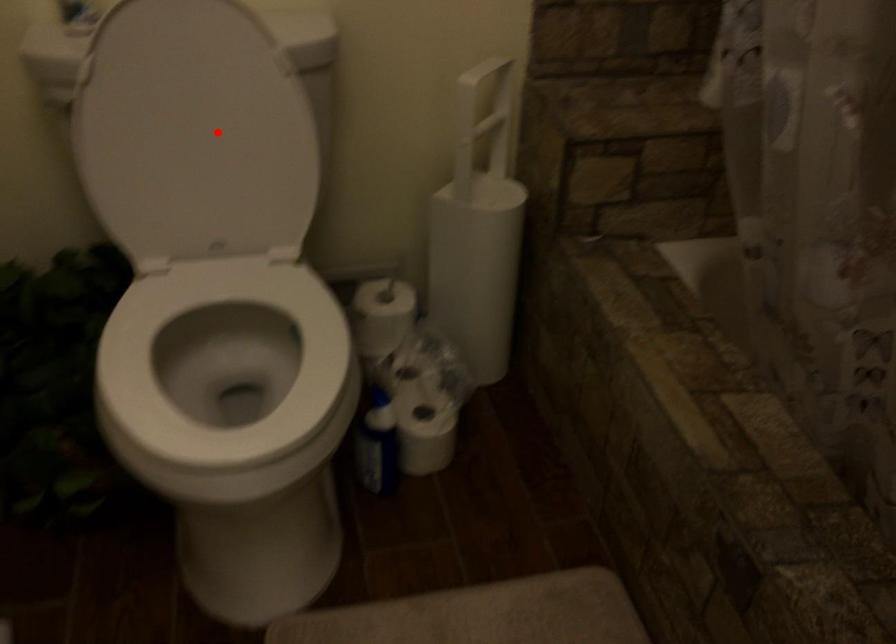
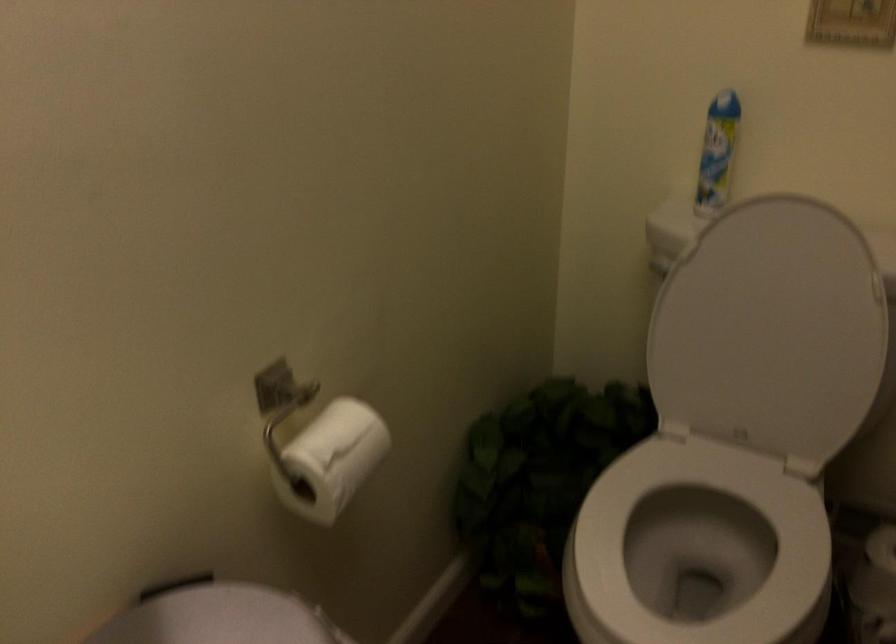
Locate, in the second image, the point that corresponds to the highlighted location in the first image.

(771, 330)